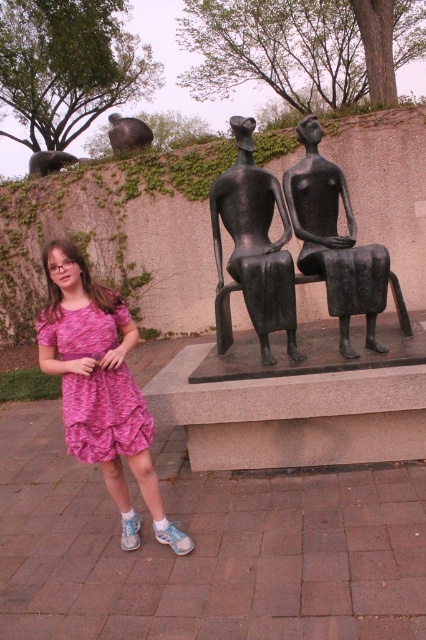
You are a photographer standing at the center of the scene. You want to capture a closeup shot of the pink fabric dress at lower left. Based on the distance provided, can you estimate whether you can focus on the dress clearly without moving closer?

The pink fabric dress at lower left is 9.02 feet away from the viewer. Since this distance is within the typical focusing range of most cameras, you can likely focus on the dress clearly without moving closer.

Looking at this image, you are a photographer trying to capture the perfect shot of the bronze sculpture at center. You notice a point at coordinates (256, 243). What object is located at that point?

The bronze sculpture at center is located at point (256, 243).

You are a photographer trying to capture both the pink fabric dress at lower left and the bronze statue at center in a single shot. Based on their heights, which object will appear larger in the photo?

The bronze statue at center will appear larger in the photo because it is taller than the pink fabric dress at lower left.